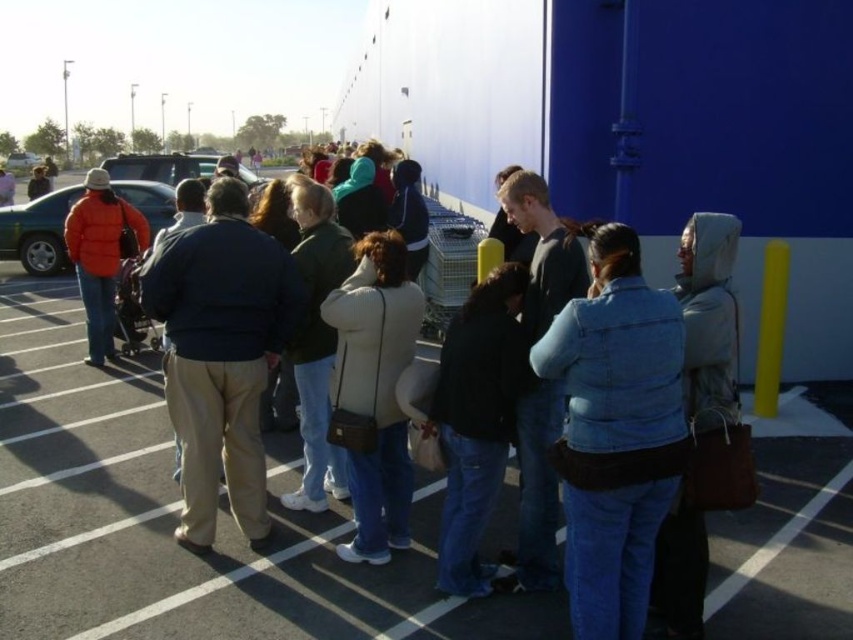
You are standing at the entrance of the store and want to locate the person wearing a denim jacket at lower right. According to the coordinates provided, where should you look relative to the entrance?

The denim jacket at lower right is located at coordinates point (614, 433), which is to the lower right direction from the entrance.

Looking at this image, you are standing in the parking lot and see two people in the line. One is wearing a light gray hooded jacket at right and the other a dark gray hoodie at center. Which person is positioned more to the right side of the line?

The light gray hooded jacket at right is positioned more to the right side of the line because it is located to the right of the dark gray hoodie at center.